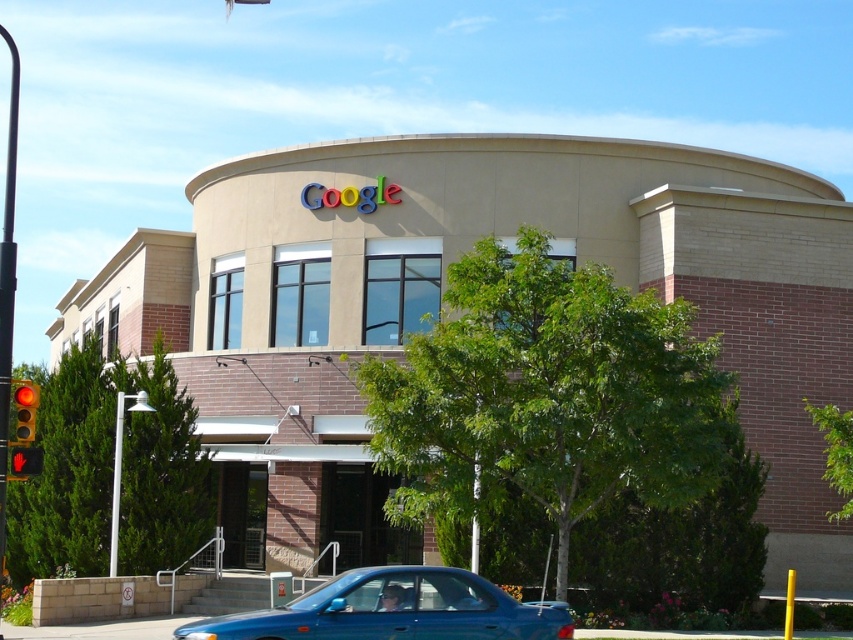
Does blue matte car at lower center have a lesser width compared to red glass traffic light at left?

No.

Which is in front, point (339, 602) or point (25, 468)?

Point (339, 602)

Is point (566, 608) positioned before point (16, 444)?

That is True.

The height and width of the screenshot is (640, 853). Find the location of `blue matte car at lower center`. blue matte car at lower center is located at coordinates (393, 611).